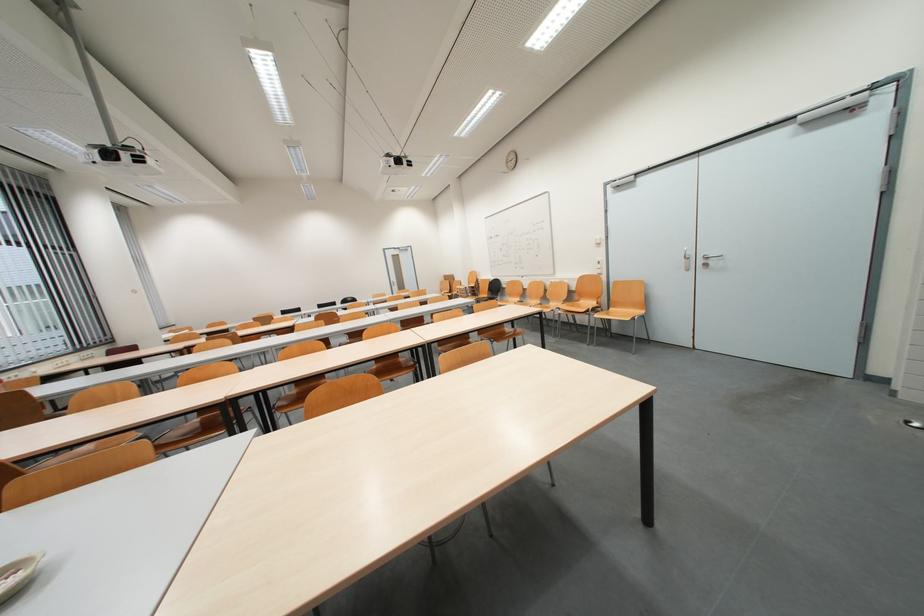
Where would you lift the small white bowl? Please return your answer as a coordinate pair (x, y).

(17, 573)